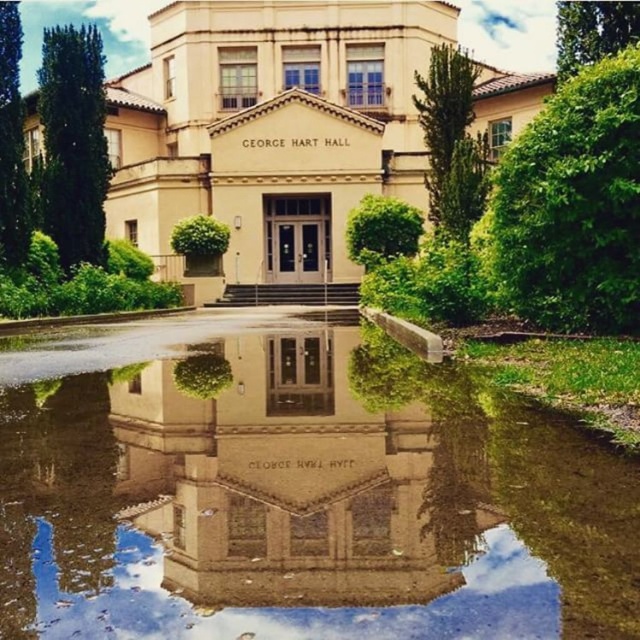
Can you confirm if clear glass water at center is smaller than beige stone building at center?

Yes.

Which is in front, point (54, 580) or point (140, 204)?

Point (54, 580) is more forward.

Where is `clear glass water at center`? clear glass water at center is located at coordinates (298, 496).